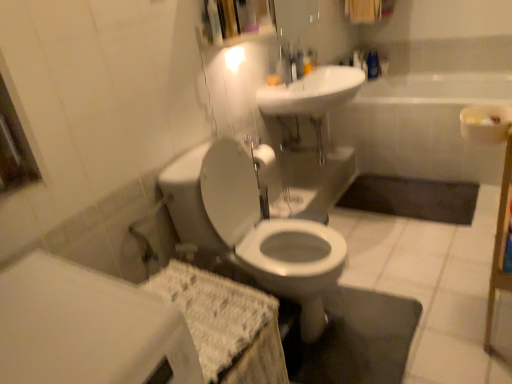
Locate an element on the screen. The width and height of the screenshot is (512, 384). vacant area situated below dark gray rubber bath mat at lower center (from a real-world perspective) is located at coordinates (413, 196).